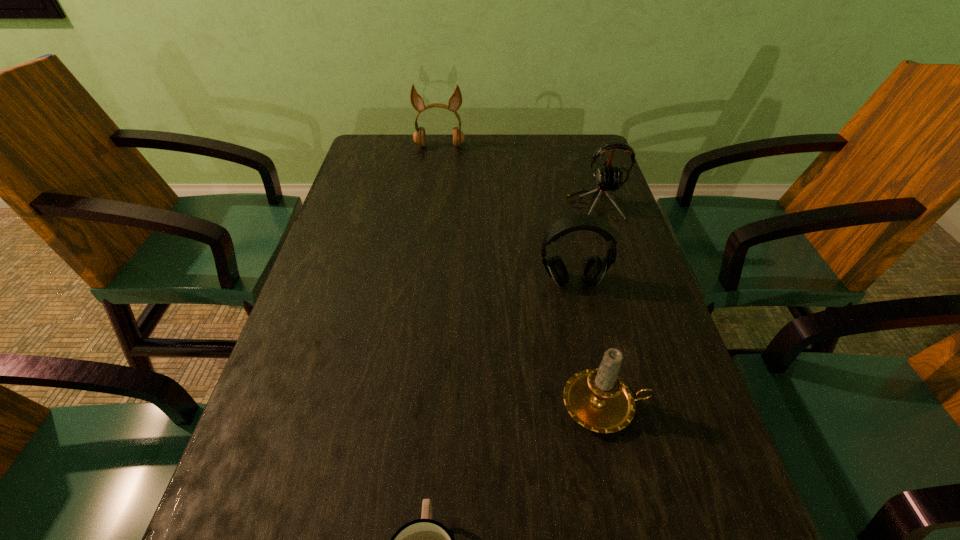
Identify the location of candle present at the right edge. (597, 399).

The width and height of the screenshot is (960, 540). In order to click on vacant space at the far edge of the desktop in this screenshot , I will do `click(423, 174)`.

Find the location of a particular element. This screenshot has width=960, height=540. vacant region at the left edge of the desktop is located at coordinates (335, 417).

Locate an element on the screen. The image size is (960, 540). vacant space at the right edge of the desktop is located at coordinates (622, 225).

The width and height of the screenshot is (960, 540). In the image, there is a desktop. In order to click on vacant space at the far right corner in this screenshot , I will do `click(552, 151)`.

You are a GUI agent. You are given a task and a screenshot of the screen. Output one action in this format:
    pyautogui.click(x=<x>, y=<y>)
    Task: Click on the free spot between the candle and the nearest earphone
    This screenshot has width=960, height=540.
    Given the screenshot: What is the action you would take?
    pyautogui.click(x=588, y=344)

Find the location of a particular element. The width and height of the screenshot is (960, 540). vacant point located between the second nearest object and the farthest earphone is located at coordinates (522, 276).

Image resolution: width=960 pixels, height=540 pixels. Find the location of `free space between the fourth nearest object and the leftmost earphone`. free space between the fourth nearest object and the leftmost earphone is located at coordinates (517, 176).

Where is `unoccupied position between the farthest earphone and the nearest earphone`? The width and height of the screenshot is (960, 540). unoccupied position between the farthest earphone and the nearest earphone is located at coordinates point(506,214).

In order to click on vacant region between the farthest object and the second nearest object in this screenshot , I will do `click(522, 276)`.